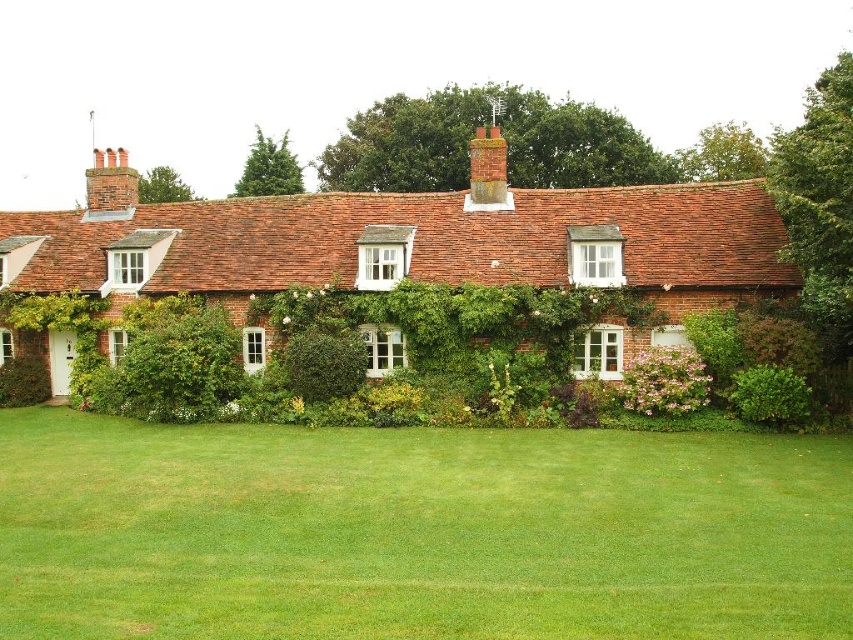
You are standing in front of the house and want to determine which of the two points, point (247, 355) or point (334, 372), is closer to you. Based on the image, which point is nearer?

Point (247, 355) is further to the viewer than point (334, 372). Therefore, point (334, 372) is closer to you.

You are standing at the center of the lawn in front of the house. You want to walk directly towards the red brick cottage at center. Which direction should you head?

Since the red brick cottage at center is located at point (412, 244), you should head towards that coordinate to reach it directly.

You are standing in front of the house and want to walk from the green leafy hedge at lower left to the green leafy hedge at lower right. Which direction should you walk to move from the higher position to the lower position?

The green leafy hedge at lower left is located above the green leafy hedge at lower right, so you should walk downward from the green leafy hedge at lower left to reach the lower positioned green leafy hedge at lower right.